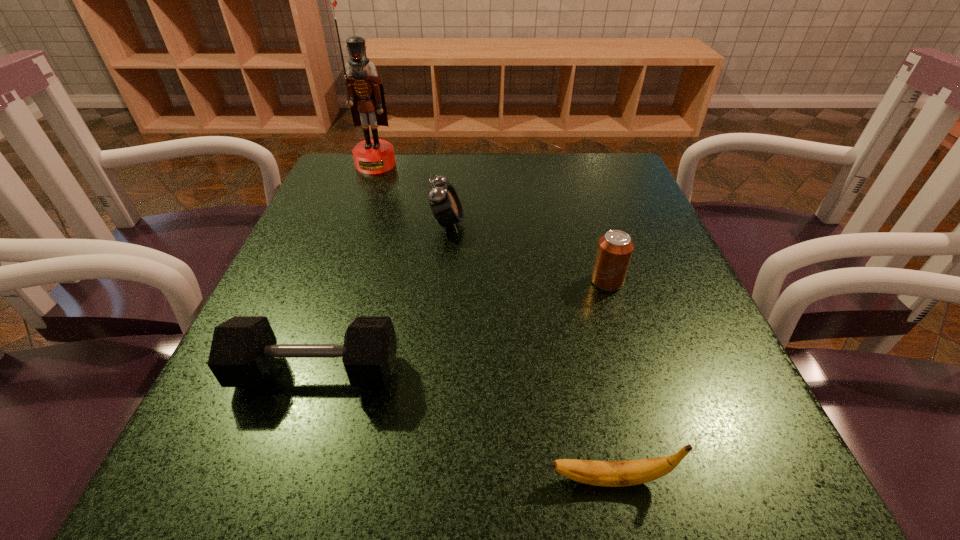
I want to click on free spot between the dumbbell and the farthest object, so click(x=346, y=268).

The width and height of the screenshot is (960, 540). What are the coordinates of `free space between the can and the banana` in the screenshot? It's located at (609, 380).

Where is `vacant space that's between the fourth nearest object and the banana`? The height and width of the screenshot is (540, 960). vacant space that's between the fourth nearest object and the banana is located at coordinates (529, 352).

Identify the location of free spot between the second nearest object and the third object from left to right. This screenshot has width=960, height=540. point(382,298).

You are a GUI agent. You are given a task and a screenshot of the screen. Output one action in this format:
    pyautogui.click(x=<x>, y=<y>)
    Task: Click on the empty space between the banana and the farthest object
    
    Given the screenshot: What is the action you would take?
    pyautogui.click(x=492, y=322)

The image size is (960, 540). Identify the location of empty space between the fourth nearest object and the third nearest object. (527, 252).

The image size is (960, 540). In order to click on vacant space that's between the dumbbell and the nutcracker in this screenshot , I will do `click(346, 268)`.

Where is `free point between the nearest object and the second farthest object`? free point between the nearest object and the second farthest object is located at coordinates (529, 352).

I want to click on blank region between the can and the nearest object, so click(609, 380).

Point out which object is positioned as the fourth nearest to the can. Please provide its 2D coordinates. Your answer should be formatted as a tuple, i.e. [(x, y)], where the tuple contains the x and y coordinates of a point satisfying the conditions above.

[(365, 95)]